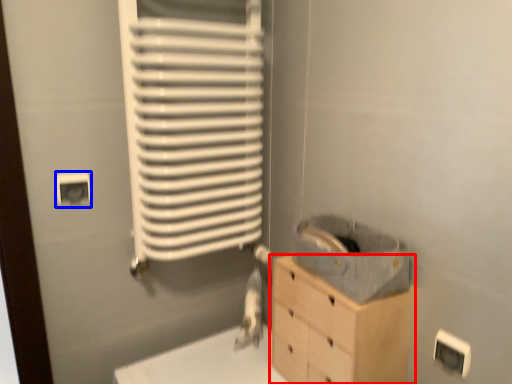
Question: Which object appears closest to the camera in this image, chest of drawers (highlighted by a red box) or electric outlet (highlighted by a blue box)?

Choices:
 (A) chest of drawers
 (B) electric outlet

Answer: (A)